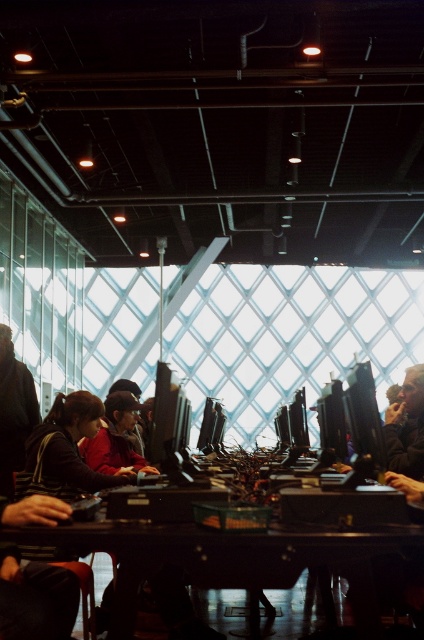
You are standing in the computer lab and need to place a new desk. Where should you position it so it doesn not block the dark brown leather jacket at left?

The dark brown leather jacket at left is located at point (13,410). Position the new desk in an area that does not overlap with this coordinate to avoid blocking it.

You are organizing a clothing drive and need to arrange the dark brown leather jacket at left and the dark brown leather jacket at center. Which jacket should you place on the left side to maintain their original positions?

The dark brown leather jacket at left should be placed on the left side since it was originally positioned on the left side of the dark brown leather jacket at center.